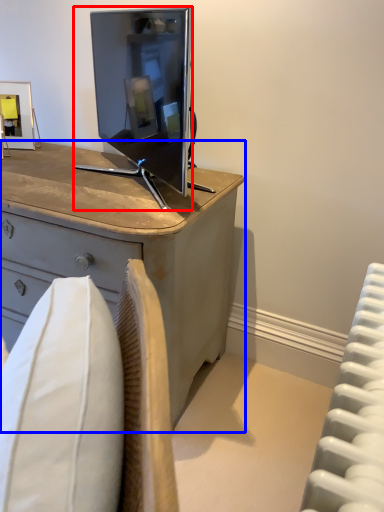
Question: Which object is further to the camera taking this photo, television (highlighted by a red box) or desk (highlighted by a blue box)?

Choices:
 (A) television
 (B) desk

Answer: (A)